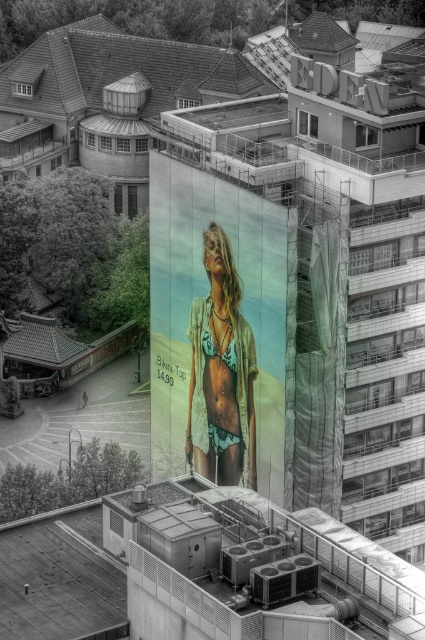
Is metallic bikini top at center to the left of matte green bikini top at center from the viewer's perspective?

Indeed, metallic bikini top at center is positioned on the left side of matte green bikini top at center.

Which is more to the right, metallic bikini top at center or matte green bikini top at center?

From the viewer's perspective, matte green bikini top at center appears more on the right side.

Is point (274, 481) positioned in front of point (193, 460)?

Yes.

Locate an element on the screen. The width and height of the screenshot is (425, 640). metallic bikini top at center is located at coordinates 221,330.